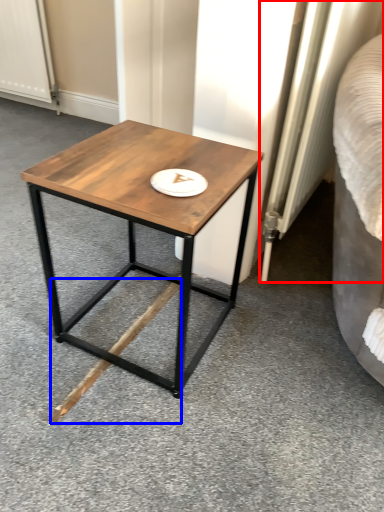
Question: Which object appears farthest to the camera in this image, radiator (highlighted by a red box) or wood (highlighted by a blue box)?

Choices:
 (A) radiator
 (B) wood

Answer: (B)